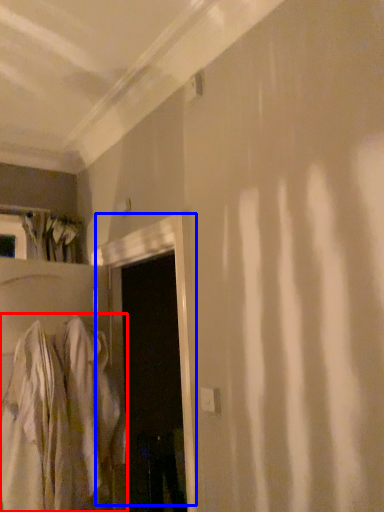
Question: Which point is further to the camera, robe (highlighted by a red box) or door (highlighted by a blue box)?

Choices:
 (A) robe
 (B) door

Answer: (A)